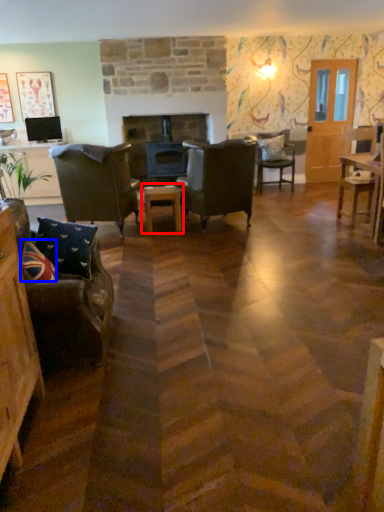
Question: Among these objects, which one is farthest to the camera, table (highlighted by a red box) or pillow (highlighted by a blue box)?

Choices:
 (A) table
 (B) pillow

Answer: (A)